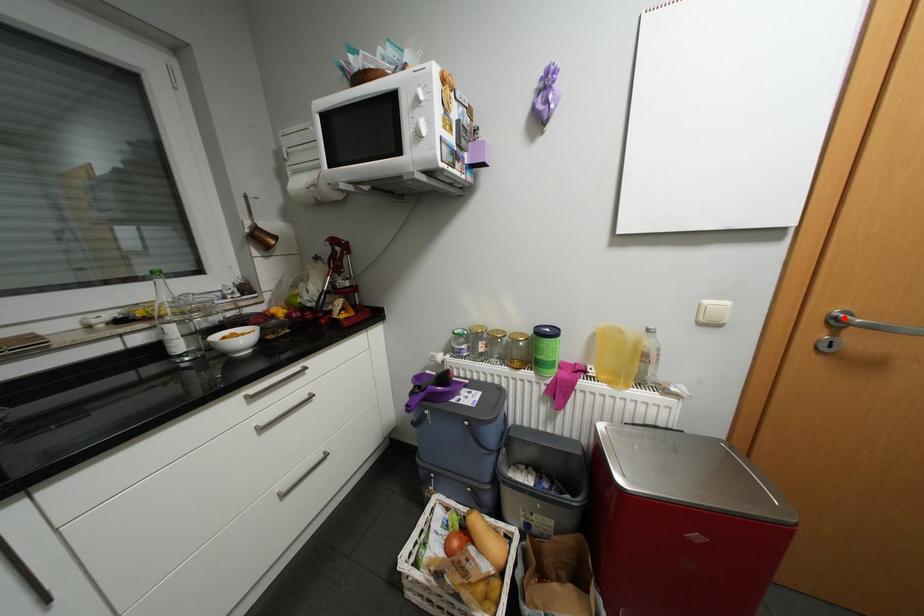
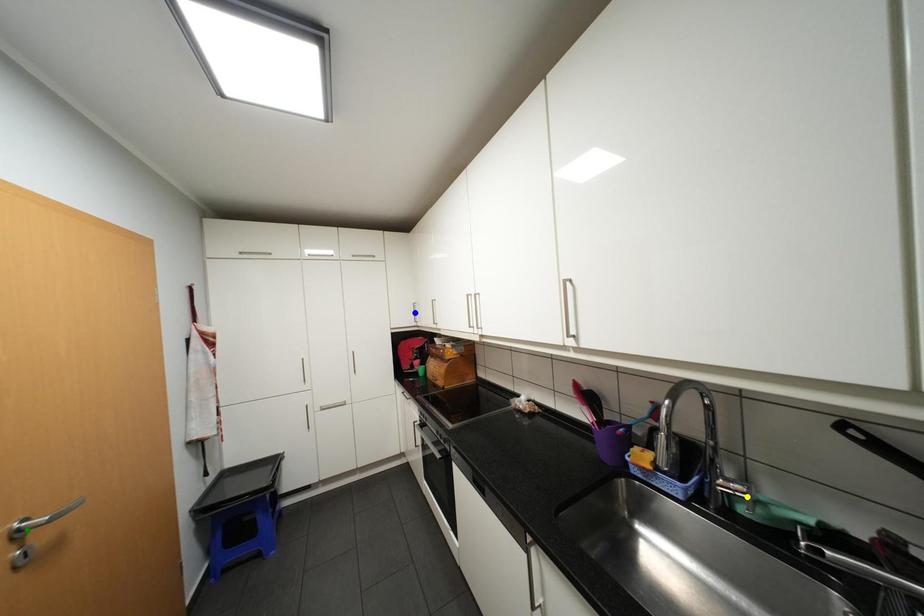
Question: I am providing you with two images of the same scene from different viewpoints. A red point is marked on the first image. You are given multiple points on the second image. Which point in image 2 is actually the same real-world point as the red point in image 1?

Choices:
 (A) green point
 (B) yellow point
 (C) blue point

Answer: (A)